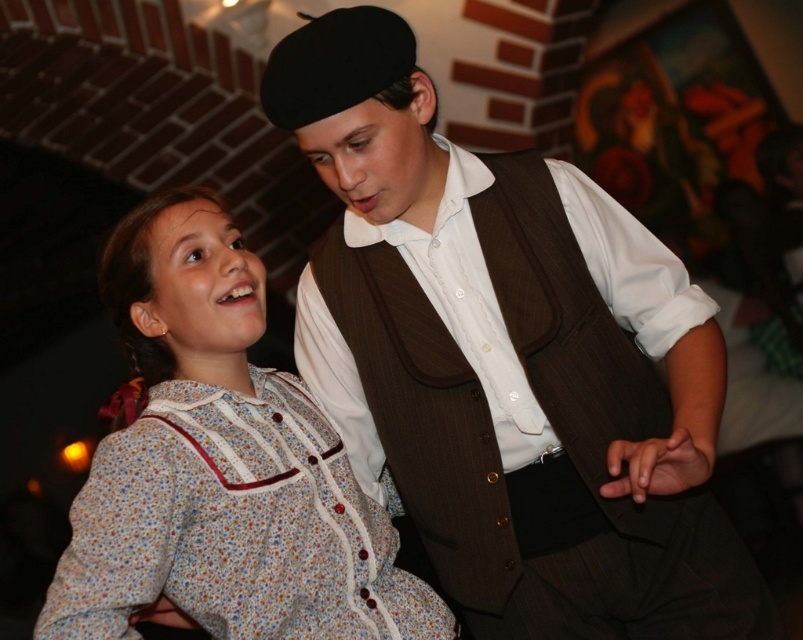
You are a photographer trying to capture a group photo of the two performers. Since the brown pinstripe vest at center and the floral cotton dress at center are both at the center, which one should you focus on to ensure the other is still in frame?

The brown pinstripe vest at center is larger than the floral cotton dress at center, so focusing on the brown pinstripe vest at center will ensure the smaller floral cotton dress at center remains in frame.

Based on the scene description, can you determine which object is wider between the brown pinstripe vest at center and the floral cotton dress at center?

The brown pinstripe vest at center is wider than the floral cotton dress at center according to the description.